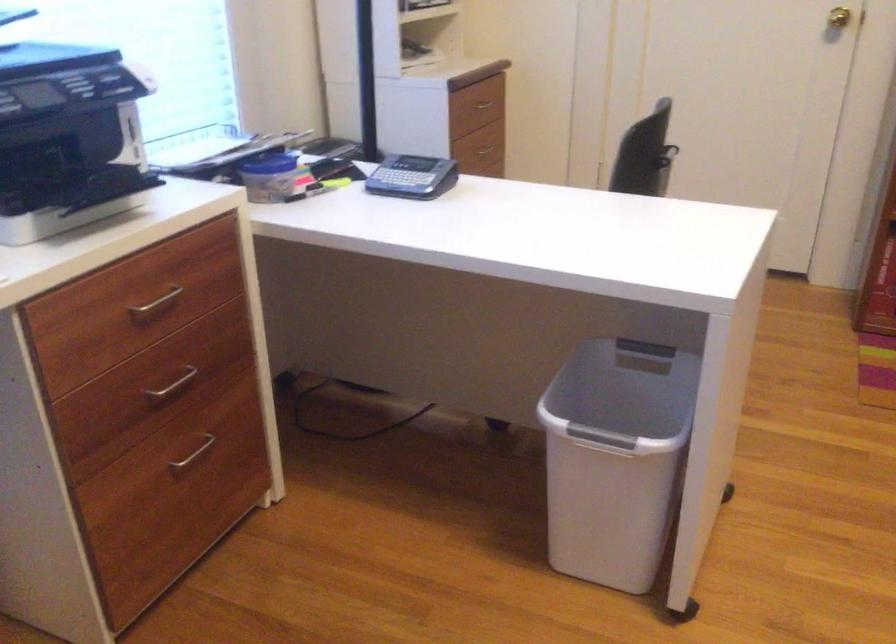
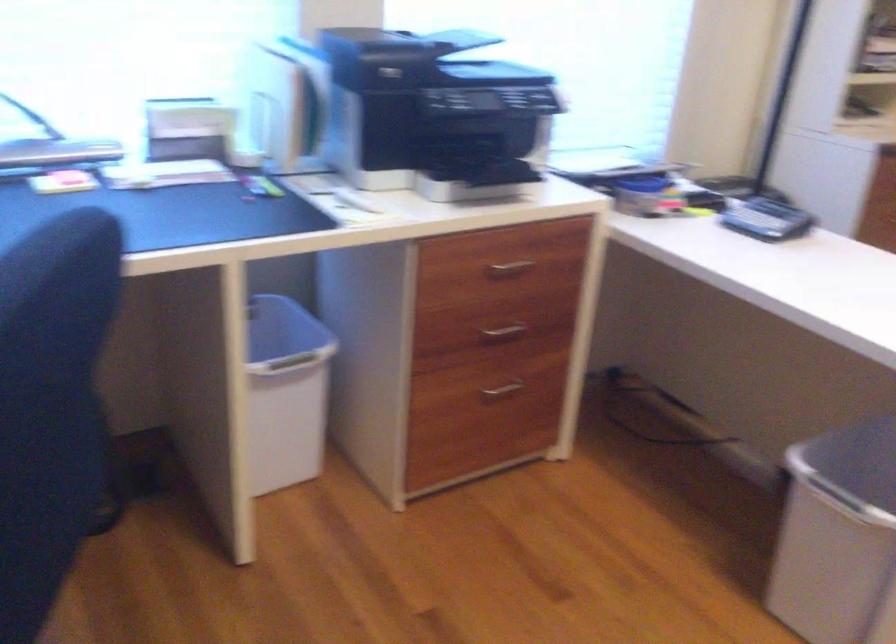
Find the pixel in the second image that matches [156,306] in the first image.

(510, 268)